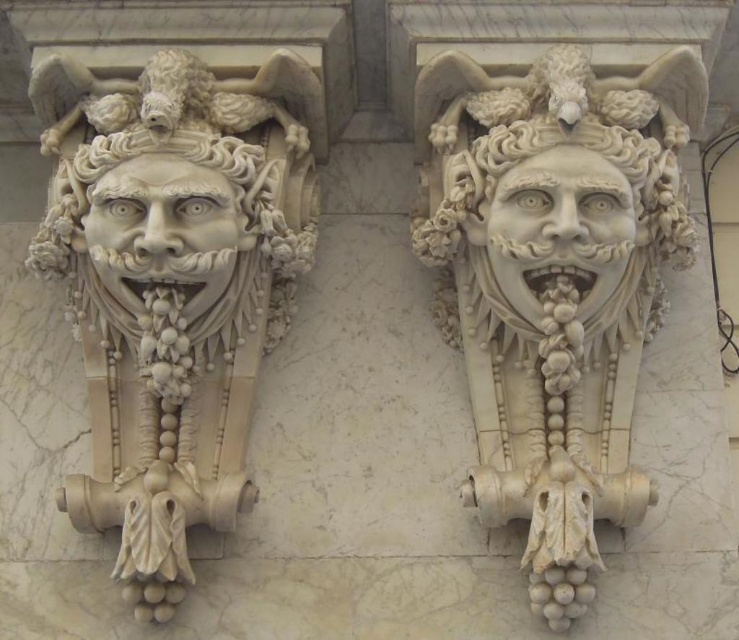
Question: Does white marble mask at left appear under white marble face at left?

Choices:
 (A) no
 (B) yes

Answer: (A)

Question: Is white marble mask at center to the left of white marble mask at left from the viewer's perspective?

Choices:
 (A) no
 (B) yes

Answer: (A)

Question: Which object is farther from the camera taking this photo?

Choices:
 (A) white marble mask at left
 (B) white marble face at left

Answer: (A)

Question: Which point appears farthest from the camera in this image?

Choices:
 (A) (522, 272)
 (B) (109, 216)

Answer: (A)

Question: Which object is positioned closest to the white marble face at left?

Choices:
 (A) white marble face at center
 (B) white marble mask at center
 (C) white marble mask at left

Answer: (C)

Question: Does white marble mask at left come behind white marble face at center?

Choices:
 (A) no
 (B) yes

Answer: (B)